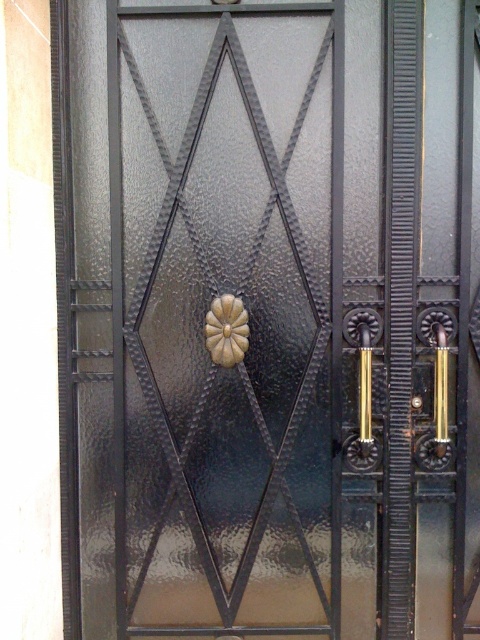
Does gold polished metal door handle at center right have a larger size compared to gold polished metal door handle at right?

Indeed, gold polished metal door handle at center right has a larger size compared to gold polished metal door handle at right.

Who is more forward, (354, 330) or (434, 333)?

Point (434, 333) is more forward.

Where is `gold polished metal door handle at center right`? Image resolution: width=480 pixels, height=640 pixels. gold polished metal door handle at center right is located at coordinates (363, 378).